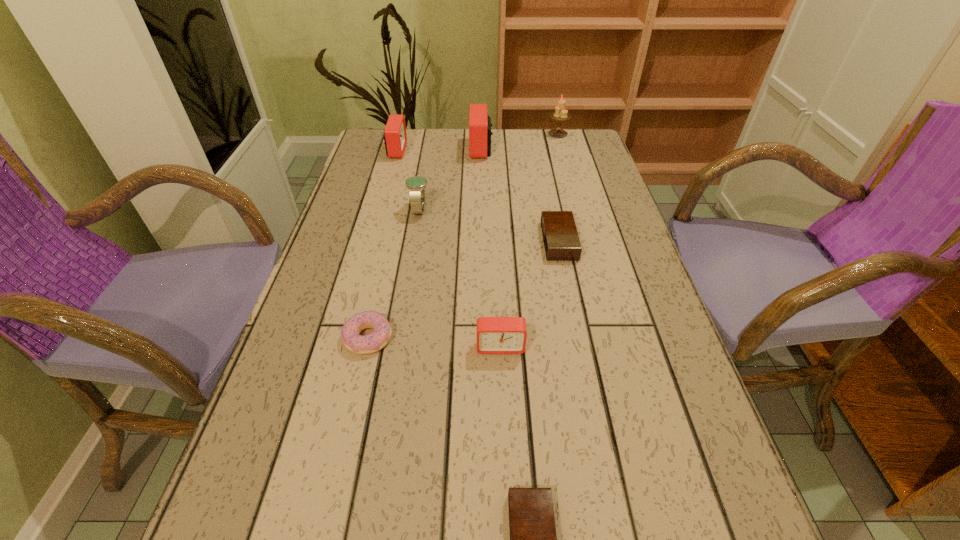
I want to click on candle holder, so click(x=560, y=114).

Identify the location of the biggest red alarm clock. The width and height of the screenshot is (960, 540). (480, 125).

Find the location of a particular element. The height and width of the screenshot is (540, 960). the leftmost alarm clock is located at coordinates (395, 138).

The height and width of the screenshot is (540, 960). In order to click on the second tallest alarm clock in this screenshot , I will do `click(395, 138)`.

Locate an element on the screen. This screenshot has width=960, height=540. blue watch is located at coordinates (416, 185).

Locate an element on the screen. The height and width of the screenshot is (540, 960). watch is located at coordinates (416, 185).

At what (x,y) coordinates should I click in order to perform the action: click on the nearest red alarm clock. Please return your answer as a coordinate pair (x, y). The width and height of the screenshot is (960, 540). Looking at the image, I should click on (495, 335).

You are a GUI agent. You are given a task and a screenshot of the screen. Output one action in this format:
    pyautogui.click(x=<x>, y=<y>)
    Task: Click on the third tallest alarm clock
    The height and width of the screenshot is (540, 960).
    Given the screenshot: What is the action you would take?
    pyautogui.click(x=495, y=335)

Where is `the bigger black alarm clock`? Image resolution: width=960 pixels, height=540 pixels. the bigger black alarm clock is located at coordinates (x=561, y=241).

Locate an element on the screen. Image resolution: width=960 pixels, height=540 pixels. the fourth tallest alarm clock is located at coordinates (561, 241).